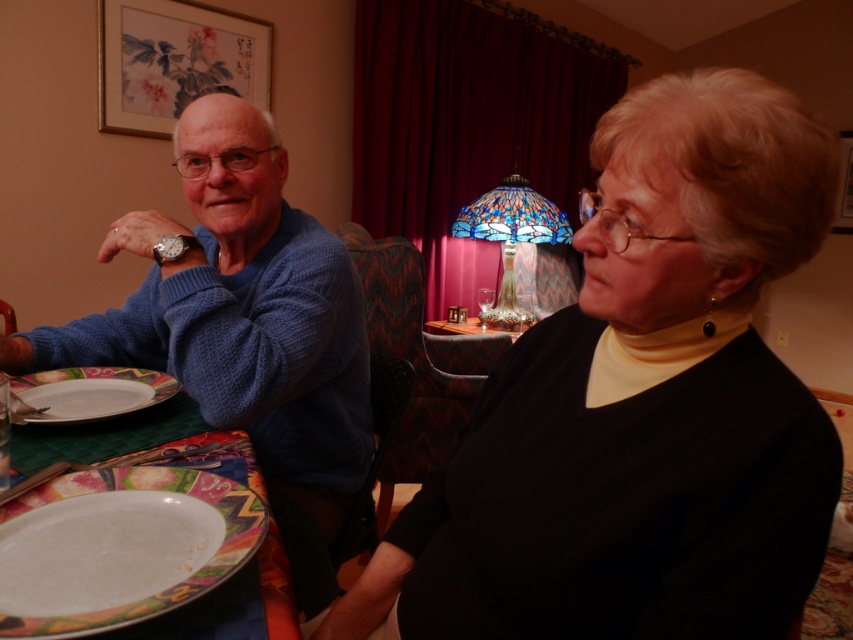
Question: Considering the real-world distances, which object is farthest from the white glossy platter at lower left?

Choices:
 (A) white glossy plate at lower left
 (B) blue knitted sweater at left
 (C) black matte dress at center

Answer: (C)

Question: Which point is farther from the camera taking this photo?

Choices:
 (A) (828, 220)
 (B) (206, 353)

Answer: (B)

Question: Which is nearer to the white glossy plate at lower left?

Choices:
 (A) white glossy platter at lower left
 (B) blue knitted sweater at left

Answer: (A)

Question: Does black matte dress at center appear over white glossy plate at lower left?

Choices:
 (A) yes
 (B) no

Answer: (A)

Question: Is black matte dress at center positioned in front of blue knitted sweater at left?

Choices:
 (A) yes
 (B) no

Answer: (A)

Question: Can you confirm if black matte dress at center is positioned to the left of white glossy platter at lower left?

Choices:
 (A) no
 (B) yes

Answer: (A)